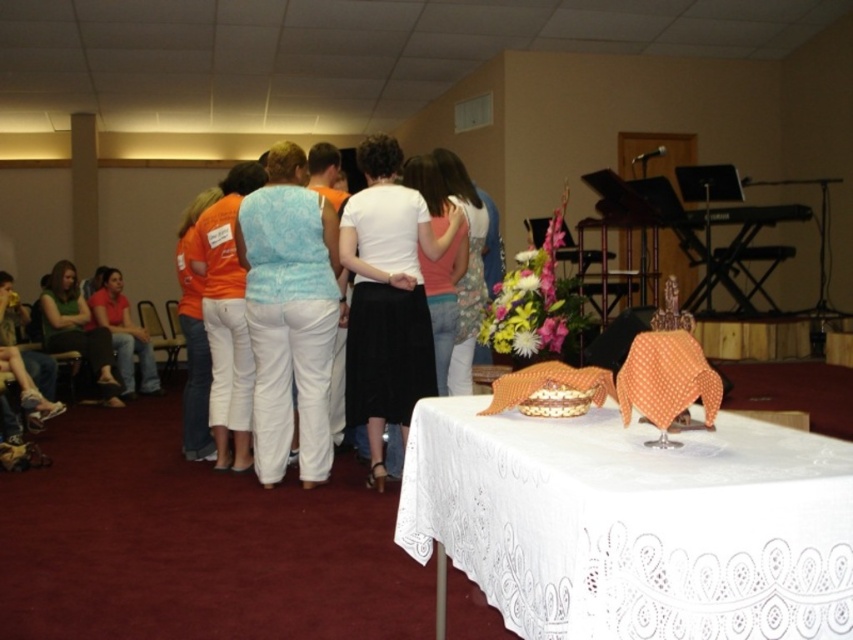
Question: Is the position of white lace tablecloth at lower right less distant than that of light blue fabric shirt at center?

Choices:
 (A) yes
 (B) no

Answer: (A)

Question: Can you confirm if orange cotton shirt at center is positioned to the right of floral-patterned fabric at center?

Choices:
 (A) yes
 (B) no

Answer: (B)

Question: Which object is positioned farthest from the green fabric shirt at lower left?

Choices:
 (A) floral-patterned fabric at center
 (B) orange cotton shirt at center

Answer: (A)

Question: Which point is closer to the camera taking this photo?

Choices:
 (A) (660, 488)
 (B) (323, 257)
 (C) (79, 307)
 (D) (198, 304)

Answer: (A)

Question: Is light blue fabric shirt at center thinner than orange cotton shirt at center?

Choices:
 (A) yes
 (B) no

Answer: (B)

Question: Considering the real-world distances, which object is closest to the orange cotton shirt at center?

Choices:
 (A) white lace tablecloth at lower right
 (B) light blue fabric shirt at center
 (C) floral-patterned fabric at center

Answer: (B)